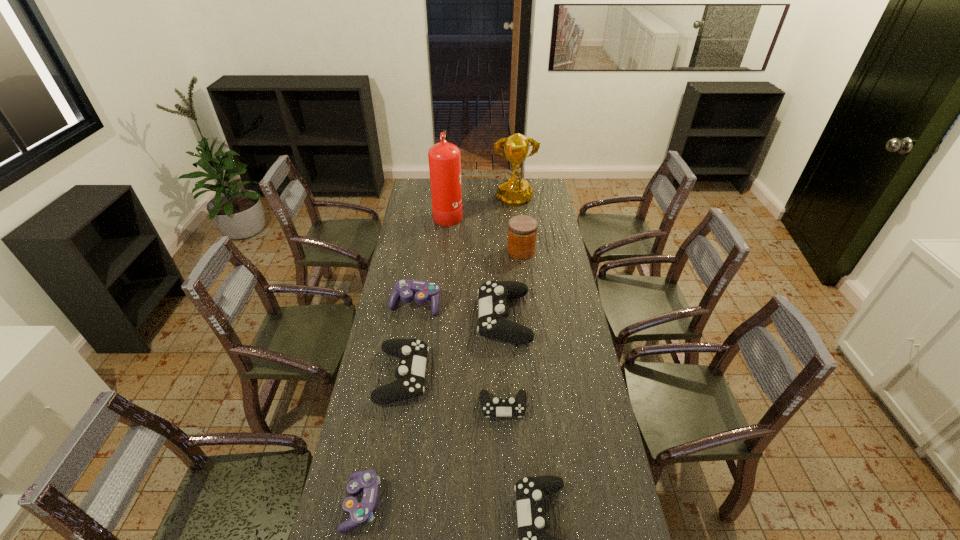
What are the coordinates of `vacant space located 0.390m on the surface of the leftmost black control` in the screenshot? It's located at (535, 375).

This screenshot has width=960, height=540. What are the coordinates of `free location located on the right of the smaller purple control` in the screenshot? It's located at (499, 504).

At what (x,y) coordinates should I click in order to perform the action: click on blank space located on the surface of the shortest control. Please return your answer as a coordinate pair (x, y). The image size is (960, 540). Looking at the image, I should click on (509, 533).

Identify the location of object located in the far edge section of the desktop. (515, 191).

At what (x,y) coordinates should I click in order to perform the action: click on fire extinguisher at the left edge. Please return your answer as a coordinate pair (x, y). Image resolution: width=960 pixels, height=540 pixels. Looking at the image, I should click on (444, 158).

Find the location of a particular element. award at the right edge is located at coordinates (515, 191).

Locate an element on the screen. jar at the right edge is located at coordinates (522, 230).

The image size is (960, 540). I want to click on object that is positioned at the far right corner, so click(515, 191).

In the image, there is a desktop. Find the location of `vacant space at the far edge`. vacant space at the far edge is located at coordinates (466, 193).

At what (x,y) coordinates should I click in order to perform the action: click on vacant space at the left edge of the desktop. Please return your answer as a coordinate pair (x, y). Image resolution: width=960 pixels, height=540 pixels. Looking at the image, I should click on (396, 307).